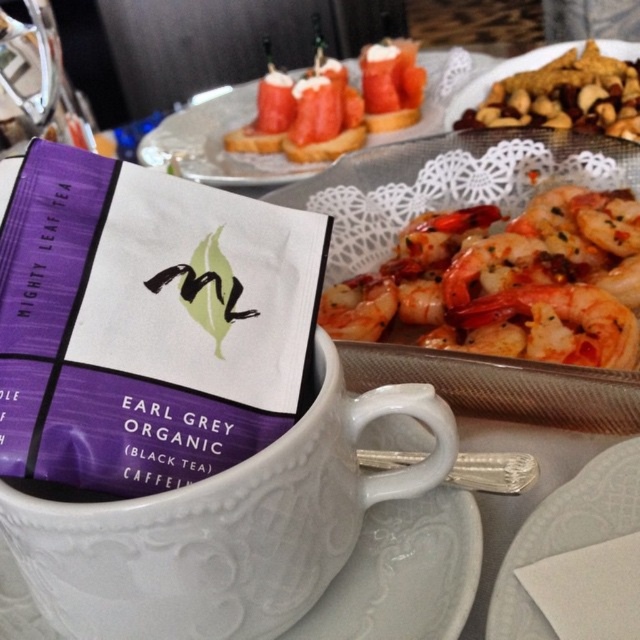
Question: Does glossy pinkish-orange shrimp at upper right appear on the left side of golden crunchy nuts at upper right?

Choices:
 (A) no
 (B) yes

Answer: (B)

Question: Which of the following is the farthest from the observer?

Choices:
 (A) purple paper earl grey tea bag at center
 (B) smooth tomato slice at upper center
 (C) golden crunchy nuts at upper right

Answer: (B)

Question: Which point is closer to the camera taking this photo?

Choices:
 (A) (454, 328)
 (B) (316, 54)
 (C) (572, 490)

Answer: (C)

Question: Which object is positioned farthest from the white porcelain saucer at center?

Choices:
 (A) smooth salmon at upper center
 (B) white lace doily at upper center
 (C) matte white plate at upper center

Answer: (A)

Question: Is purple paper earl grey tea bag at center bigger than glossy pinkish-orange shrimp at upper right?

Choices:
 (A) no
 (B) yes

Answer: (A)

Question: Does smooth tomato slice at upper center appear over golden crunchy nuts at upper right?

Choices:
 (A) yes
 (B) no

Answer: (A)